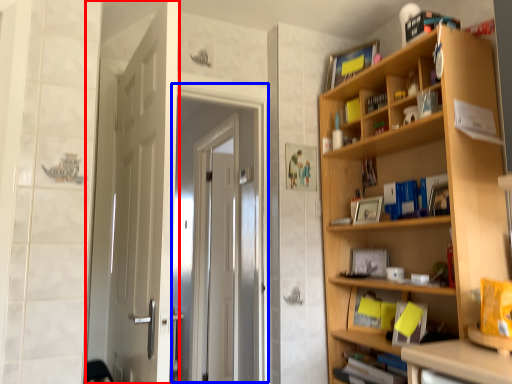
Question: Which of the following is the closest to the observer, door (highlighted by a red box) or screen door (highlighted by a blue box)?

Choices:
 (A) door
 (B) screen door

Answer: (A)